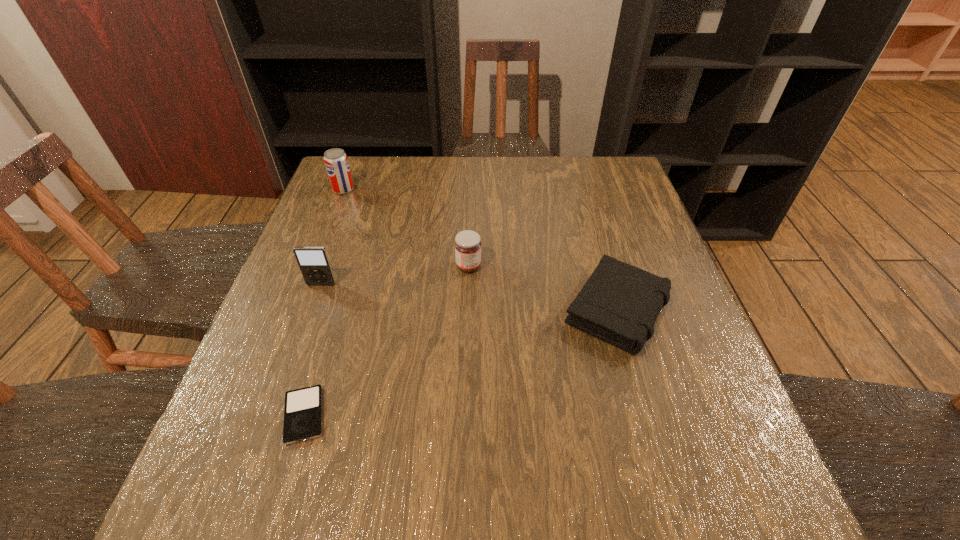
At what (x,y) coordinates should I click in order to perform the action: click on free space located 0.350m on the front of the third tallest object. Please return your answer as a coordinate pair (x, y). Looking at the image, I should click on (465, 411).

The width and height of the screenshot is (960, 540). In order to click on blank area located on the back of the fourth tallest object in this screenshot , I will do `click(592, 225)`.

Where is `free space located 0.120m on the front of the shorter iPod`? The height and width of the screenshot is (540, 960). free space located 0.120m on the front of the shorter iPod is located at coordinates (272, 523).

I want to click on object that is at the far edge, so click(336, 162).

Locate an element on the screen. soda present at the left edge is located at coordinates (336, 162).

Locate an element on the screen. This screenshot has height=540, width=960. object at the right edge is located at coordinates (619, 303).

The height and width of the screenshot is (540, 960). Find the location of `object located in the far left corner section of the desktop`. object located in the far left corner section of the desktop is located at coordinates (336, 162).

Identify the location of free space at the far edge. This screenshot has width=960, height=540. (547, 184).

This screenshot has height=540, width=960. In the image, there is a desktop. In order to click on vacant space at the near edge in this screenshot , I will do `click(633, 489)`.

You are a GUI agent. You are given a task and a screenshot of the screen. Output one action in this format:
    pyautogui.click(x=<x>, y=<y>)
    Task: Click on the vacant space at the left edge
    
    Given the screenshot: What is the action you would take?
    pyautogui.click(x=348, y=217)